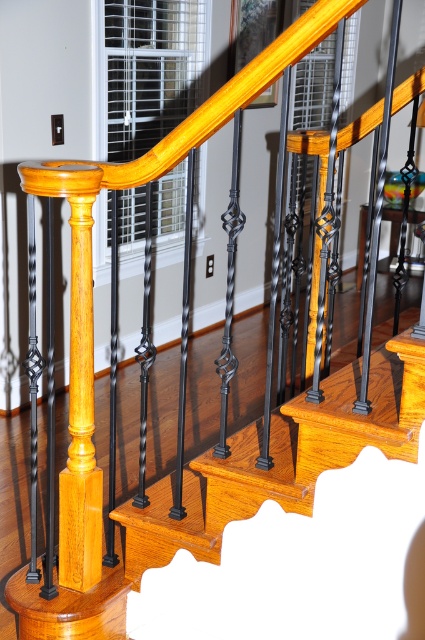
Question: Which object appears closest to the camera in this image?

Choices:
 (A) matte black wrought iron at center
 (B) light brown wood post at center

Answer: (A)

Question: Can you confirm if matte black wrought iron at center is positioned above light brown wood post at center?

Choices:
 (A) yes
 (B) no

Answer: (B)

Question: Is matte black wrought iron at center to the left of light brown wood post at center from the viewer's perspective?

Choices:
 (A) yes
 (B) no

Answer: (B)

Question: Can you confirm if matte black wrought iron at center is wider than light brown wood post at center?

Choices:
 (A) no
 (B) yes

Answer: (B)